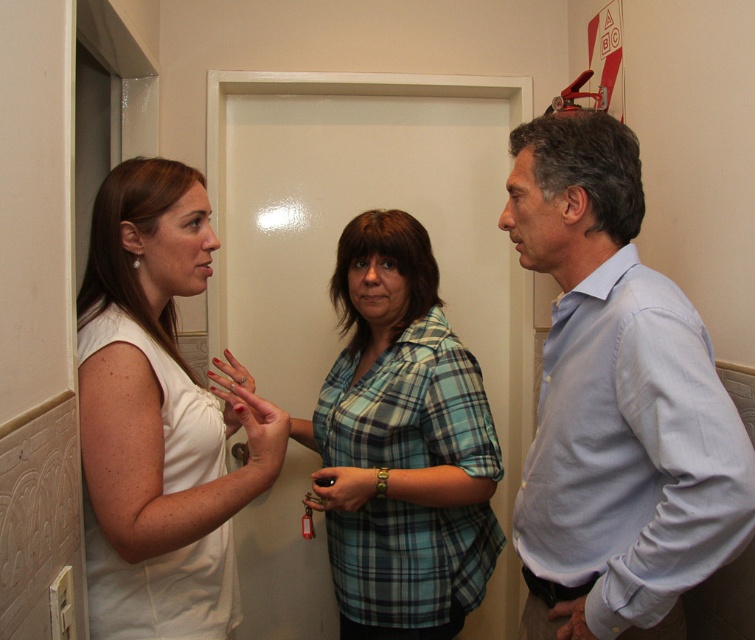
Consider the image. Is white matte dress at left shorter than smooth skin hand at lower center?

No, white matte dress at left is not shorter than smooth skin hand at lower center.

Is point (96, 275) more distant than point (566, 634)?

Yes, point (96, 275) is farther from viewer.

Where is `white matte dress at left`? Image resolution: width=755 pixels, height=640 pixels. white matte dress at left is located at coordinates (156, 417).

Can you confirm if matte brown leather wallet at center is wider than smooth skin hand at lower center?

Indeed, matte brown leather wallet at center has a greater width compared to smooth skin hand at lower center.

Can you confirm if matte brown leather wallet at center is positioned below smooth skin hand at lower center?

Incorrect, matte brown leather wallet at center is not positioned below smooth skin hand at lower center.

Does point (313, 486) come behind point (584, 630)?

Yes, it is.

The image size is (755, 640). In order to click on matte brown leather wallet at center in this screenshot , I will do `click(341, 486)`.

Is white matte dress at left shorter than matte brown leather wallet at center?

No, white matte dress at left is not shorter than matte brown leather wallet at center.

Who is positioned more to the left, white matte dress at left or matte brown leather wallet at center?

white matte dress at left

Find the location of `white matte dress at left`. white matte dress at left is located at coordinates click(156, 417).